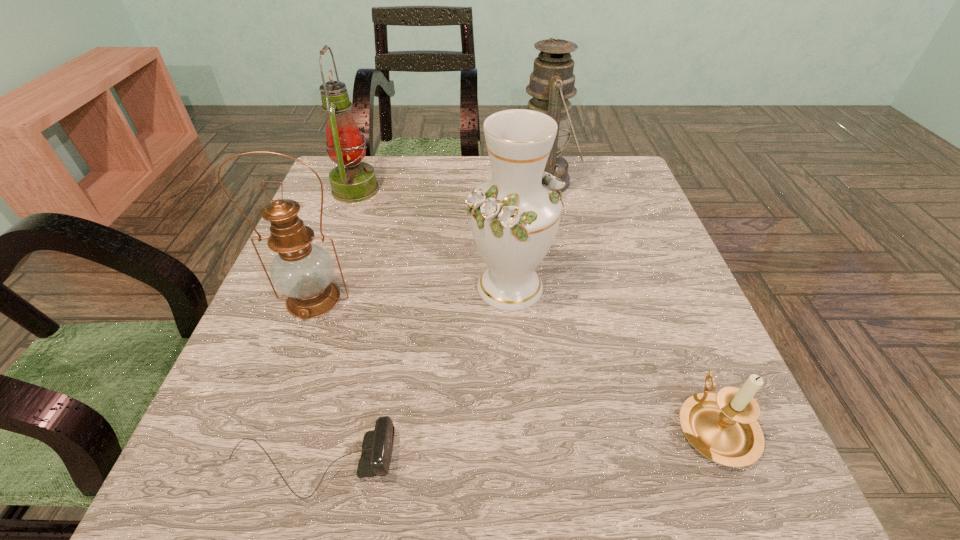
The image size is (960, 540). In order to click on vacant region located with a handle on the side of the rightmost object in this screenshot , I will do `click(644, 254)`.

At what (x,y) coordinates should I click in order to perform the action: click on vacant space located with a handle on the side of the rightmost object. Please return your answer as a coordinate pair (x, y). The image size is (960, 540). Looking at the image, I should click on (681, 342).

The width and height of the screenshot is (960, 540). In order to click on free region located on the front-facing side of the shortest object in this screenshot , I will do `click(505, 464)`.

Identify the location of candle holder located at the near edge. The image size is (960, 540). tap(723, 427).

Identify the location of webcam at the near edge. The image size is (960, 540). (377, 446).

This screenshot has height=540, width=960. Identify the location of webcam that is at the left edge. (377, 446).

Where is `oil lamp that is at the right edge`? The height and width of the screenshot is (540, 960). oil lamp that is at the right edge is located at coordinates (552, 81).

The image size is (960, 540). I want to click on candle holder situated at the right edge, so click(x=723, y=427).

The width and height of the screenshot is (960, 540). What are the coordinates of `object that is at the far left corner` in the screenshot? It's located at (352, 181).

Identify the location of object that is at the near left corner. The width and height of the screenshot is (960, 540). (377, 446).